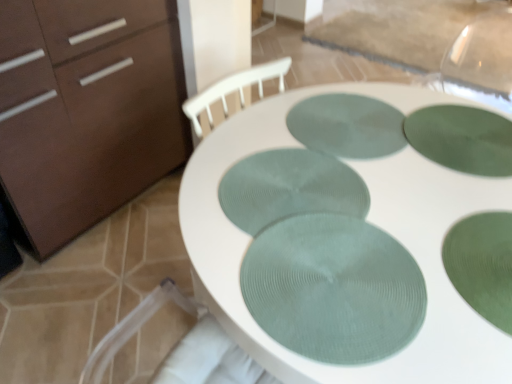
Where is `vacant space behind green textured glass plate at center, placed as the fifth glass plate when sorted from back to front`? The image size is (512, 384). vacant space behind green textured glass plate at center, placed as the fifth glass plate when sorted from back to front is located at coordinates [317, 181].